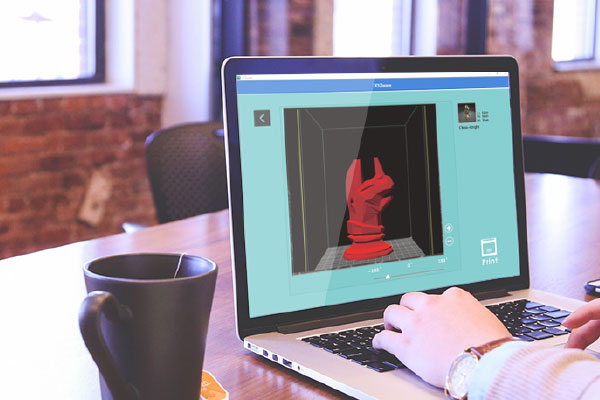
At what (x,y) coordinates should I click in order to perform the action: click on chairs. Please return your answer as a coordinate pair (x, y). The height and width of the screenshot is (400, 600). Looking at the image, I should click on click(x=191, y=170), click(x=550, y=147).